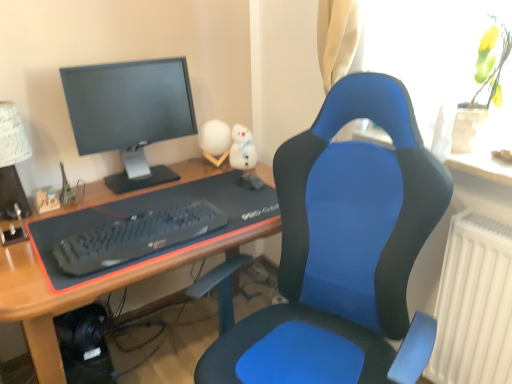
Question: From a real-world perspective, is blue fabric chair at center beneath black matte keyboard at center?

Choices:
 (A) yes
 (B) no

Answer: (A)

Question: Does blue fabric chair at center have a lesser height compared to black matte keyboard at center?

Choices:
 (A) no
 (B) yes

Answer: (A)

Question: Considering the relative sizes of blue fabric chair at center and black matte keyboard at center in the image provided, is blue fabric chair at center bigger than black matte keyboard at center?

Choices:
 (A) no
 (B) yes

Answer: (B)

Question: Can we say blue fabric chair at center lies outside black matte keyboard at center?

Choices:
 (A) yes
 (B) no

Answer: (A)

Question: From a real-world perspective, is blue fabric chair at center on black matte keyboard at center?

Choices:
 (A) no
 (B) yes

Answer: (A)

Question: Is black matte keyboard at center wider or thinner than blue fabric desk at center?

Choices:
 (A) thin
 (B) wide

Answer: (A)

Question: Is black matte keyboard at center situated inside blue fabric desk at center or outside?

Choices:
 (A) inside
 (B) outside

Answer: (B)

Question: Considering the positions of black matte keyboard at center and blue fabric desk at center in the image, is black matte keyboard at center bigger or smaller than blue fabric desk at center?

Choices:
 (A) small
 (B) big

Answer: (A)

Question: From the image's perspective, is black matte keyboard at center located above or below blue fabric desk at center?

Choices:
 (A) below
 (B) above

Answer: (B)

Question: From the image's perspective, is transparent glass vase at upper right above or below black matte keyboard at center?

Choices:
 (A) above
 (B) below

Answer: (A)

Question: In the image, is transparent glass vase at upper right positioned in front of or behind black matte keyboard at center?

Choices:
 (A) front
 (B) behind

Answer: (A)

Question: In terms of width, does transparent glass vase at upper right look wider or thinner when compared to black matte keyboard at center?

Choices:
 (A) wide
 (B) thin

Answer: (A)

Question: From a real-world perspective, is transparent glass vase at upper right above or below black matte keyboard at center?

Choices:
 (A) above
 (B) below

Answer: (A)

Question: Which is correct: blue fabric desk at center is inside black matte keyboard at center, or outside of it?

Choices:
 (A) outside
 (B) inside

Answer: (A)

Question: Considering the positions of point (27, 263) and point (197, 231), is point (27, 263) closer or farther from the camera than point (197, 231)?

Choices:
 (A) closer
 (B) farther

Answer: (A)